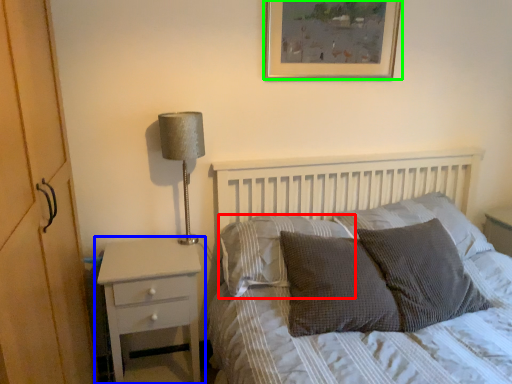
Question: Which object is positioned farthest from pillow (highlighted by a red box)? Select from nightstand (highlighted by a blue box) and picture frame (highlighted by a green box).

Choices:
 (A) nightstand
 (B) picture frame

Answer: (B)